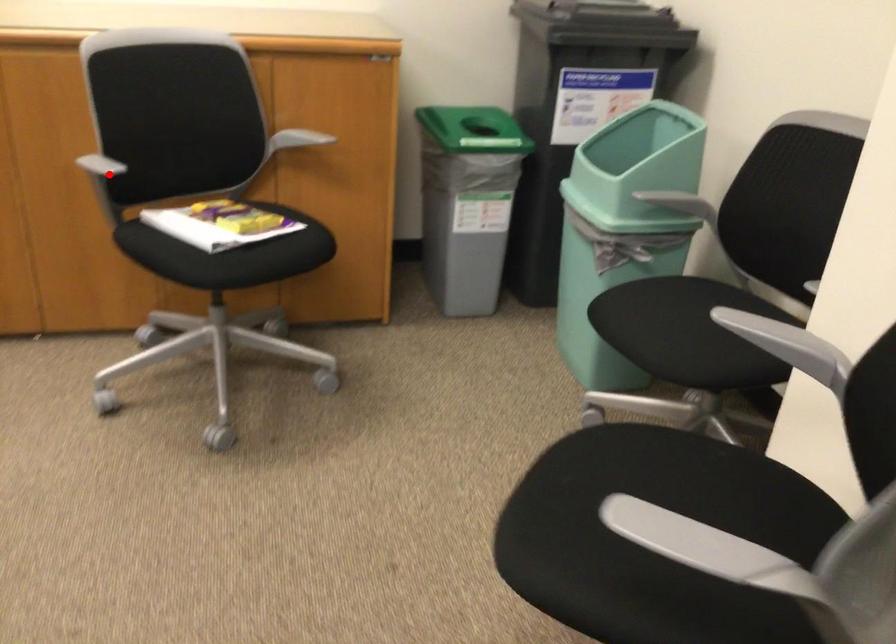
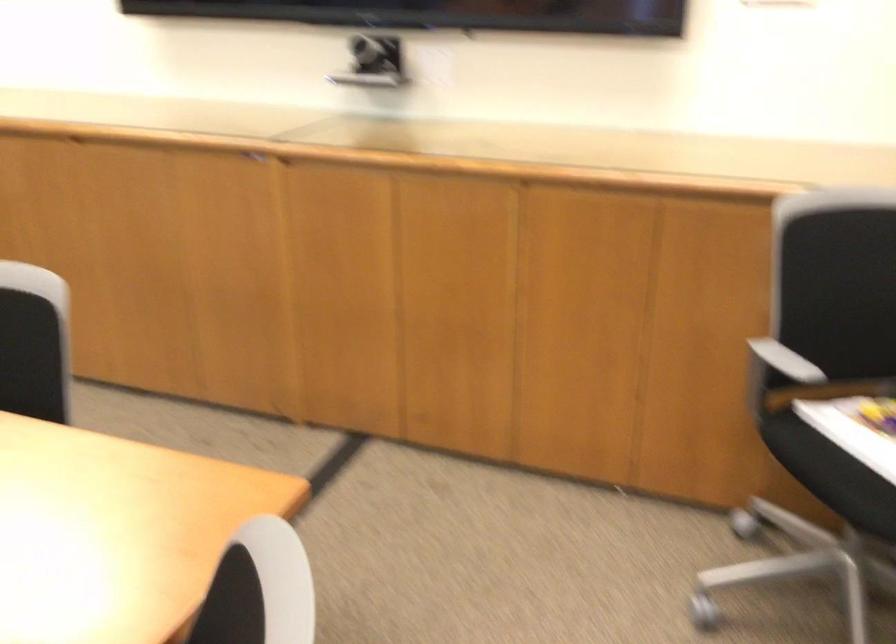
Locate, in the second image, the point that corresponds to the highlighted location in the first image.

(778, 374)